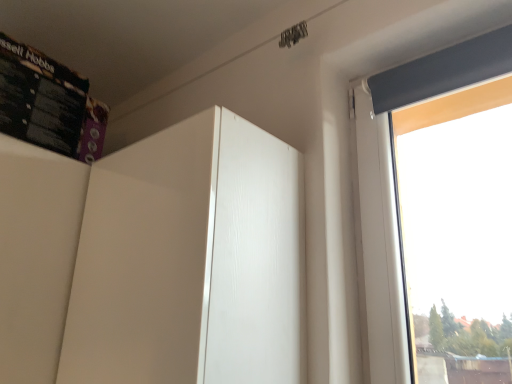
Question: Looking at the image, does white glossy cabinet at center seem bigger or smaller compared to black cardboard box at upper left?

Choices:
 (A) small
 (B) big

Answer: (B)

Question: Does point (125, 218) appear closer or farther from the camera than point (25, 46)?

Choices:
 (A) farther
 (B) closer

Answer: (B)

Question: Is white glossy cabinet at center in front of or behind black cardboard box at upper left in the image?

Choices:
 (A) behind
 (B) front

Answer: (B)

Question: Looking at the image, does black cardboard box at upper left seem bigger or smaller compared to white glossy cabinet at center?

Choices:
 (A) small
 (B) big

Answer: (A)

Question: Is point (88, 86) positioned closer to the camera than point (297, 322)?

Choices:
 (A) farther
 (B) closer

Answer: (A)

Question: From a real-world perspective, is black cardboard box at upper left above or below white glossy cabinet at center?

Choices:
 (A) above
 (B) below

Answer: (A)

Question: Is black cardboard box at upper left to the left or to the right of white glossy cabinet at center in the image?

Choices:
 (A) right
 (B) left

Answer: (B)